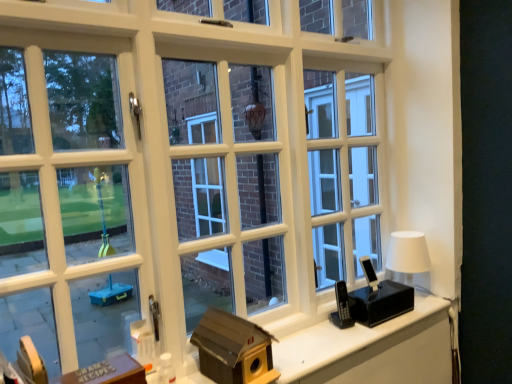
Locate an element on the screen. This screenshot has height=384, width=512. brown cardboard birdhouse at center is located at coordinates (232, 348).

This screenshot has height=384, width=512. In order to click on metallic silver buttons at lower left in this screenshot , I will do `click(108, 372)`.

Is brown cardboard birdhouse at center located within metallic silver buttons at lower left?

No, brown cardboard birdhouse at center is not surrounded by metallic silver buttons at lower left.

From a real-world perspective, is metallic silver buttons at lower left physically located above or below brown cardboard birdhouse at center?

Clearly, from a real-world perspective, metallic silver buttons at lower left is below brown cardboard birdhouse at center.

From the image's perspective, which one is positioned lower, metallic silver buttons at lower left or brown cardboard birdhouse at center?

metallic silver buttons at lower left appears lower in the image.

Who is taller, wooden birdhouse at lower right or metallic silver buttons at lower left?

With more height is metallic silver buttons at lower left.

From the image's perspective, who appears lower, wooden birdhouse at lower right or metallic silver buttons at lower left?

wooden birdhouse at lower right.

I want to click on table that appears on the left of wooden birdhouse at lower right, so 108,372.

Does wooden birdhouse at lower right turn towards metallic silver buttons at lower left?

No, wooden birdhouse at lower right is not facing towards metallic silver buttons at lower left.

Can you tell me how much metallic silver buttons at lower left and wooden birdhouse at lower right differ in facing direction?

0.391 degrees.

This screenshot has height=384, width=512. Find the location of `computer desk behind the metallic silver buttons at lower left`. computer desk behind the metallic silver buttons at lower left is located at coordinates (372, 349).

Is metallic silver buttons at lower left far from wooden birdhouse at lower right?

No, there isn't a large distance between metallic silver buttons at lower left and wooden birdhouse at lower right.

Can you confirm if metallic silver buttons at lower left is positioned to the right of wooden birdhouse at lower right?

No.

Would you say wooden birdhouse at lower right is inside or outside brown cardboard birdhouse at center?

wooden birdhouse at lower right is not inside brown cardboard birdhouse at center, it's outside.

This screenshot has width=512, height=384. In order to click on computer desk in front of the brown cardboard birdhouse at center in this screenshot , I will do `click(372, 349)`.

Can you confirm if wooden birdhouse at lower right is wider than brown cardboard birdhouse at center?

No, wooden birdhouse at lower right is not wider than brown cardboard birdhouse at center.

Who is taller, wooden birdhouse at lower right or brown cardboard birdhouse at center?

With more height is brown cardboard birdhouse at center.

Is the surface of white matte table lamp at right in direct contact with metallic silver buttons at lower left?

white matte table lamp at right and metallic silver buttons at lower left are not in contact.

Is metallic silver buttons at lower left inside white matte table lamp at right?

No, metallic silver buttons at lower left is not a part of white matte table lamp at right.

Is white matte table lamp at right further to the viewer compared to metallic silver buttons at lower left?

Yes, the depth of white matte table lamp at right is greater than that of metallic silver buttons at lower left.

Who is smaller, white matte table lamp at right or metallic silver buttons at lower left?

metallic silver buttons at lower left is smaller.

Considering the relative sizes of metallic silver buttons at lower left and white matte table lamp at right in the image provided, is metallic silver buttons at lower left shorter than white matte table lamp at right?

Indeed, metallic silver buttons at lower left has a lesser height compared to white matte table lamp at right.

Is metallic silver buttons at lower left bigger than white matte table lamp at right?

Actually, metallic silver buttons at lower left might be smaller than white matte table lamp at right.

Between metallic silver buttons at lower left and white matte table lamp at right, which one appears on the left side from the viewer's perspective?

metallic silver buttons at lower left.

Can you confirm if brown cardboard birdhouse at center is shorter than wooden birdhouse at lower right?

No.

Which is behind, point (245, 327) or point (295, 354)?

The point (295, 354) is farther.

Which of these two, brown cardboard birdhouse at center or wooden birdhouse at lower right, is smaller?

brown cardboard birdhouse at center.

Which of these two, brown cardboard birdhouse at center or wooden birdhouse at lower right, is wider?

Wider between the two is brown cardboard birdhouse at center.

Locate an element on the screen. table on the left of brown cardboard birdhouse at center is located at coordinates (108, 372).

Find the location of a particular element. The height and width of the screenshot is (384, 512). table above the wooden birdhouse at lower right (from the image's perspective) is located at coordinates (108, 372).

Considering their positions, is brown cardboard birdhouse at center positioned closer to white matte table lamp at right than metallic silver buttons at lower left?

brown cardboard birdhouse at center is closer to white matte table lamp at right.

Based on their spatial positions, is metallic silver buttons at lower left or brown cardboard birdhouse at center closer to wooden birdhouse at lower right?

brown cardboard birdhouse at center.

From the image, which object appears to be nearer to wooden birdhouse at lower right, white matte table lamp at right or metallic silver buttons at lower left?

white matte table lamp at right is positioned closer to the anchor wooden birdhouse at lower right.

Estimate the real-world distances between objects in this image. Which object is further from metallic silver buttons at lower left, brown cardboard birdhouse at center or wooden birdhouse at lower right?

wooden birdhouse at lower right lies further to metallic silver buttons at lower left than the other object.

Estimate the real-world distances between objects in this image. Which object is further from metallic silver buttons at lower left, white matte table lamp at right or brown cardboard birdhouse at center?

Based on the image, white matte table lamp at right appears to be further to metallic silver buttons at lower left.

Considering their positions, is metallic silver buttons at lower left positioned further to white matte table lamp at right than wooden birdhouse at lower right?

metallic silver buttons at lower left is further to white matte table lamp at right.

Considering their positions, is brown cardboard birdhouse at center positioned closer to white matte table lamp at right than wooden birdhouse at lower right?

wooden birdhouse at lower right lies closer to white matte table lamp at right than the other object.

From the image, which object appears to be farther from brown cardboard birdhouse at center, wooden birdhouse at lower right or white matte table lamp at right?

white matte table lamp at right is further to brown cardboard birdhouse at center.

You are a GUI agent. You are given a task and a screenshot of the screen. Output one action in this format:
    pyautogui.click(x=<x>, y=<y>)
    Task: Click on the computer desk between brown cardboard birdhouse at center and white matte table lamp at right
    The height and width of the screenshot is (384, 512).
    Given the screenshot: What is the action you would take?
    pyautogui.click(x=372, y=349)

You are a GUI agent. You are given a task and a screenshot of the screen. Output one action in this format:
    pyautogui.click(x=<x>, y=<y>)
    Task: Click on the computer desk situated between metallic silver buttons at lower left and white matte table lamp at right from left to right
    This screenshot has height=384, width=512.
    Given the screenshot: What is the action you would take?
    pyautogui.click(x=372, y=349)

At what (x,y) coordinates should I click in order to perform the action: click on box between metallic silver buttons at lower left and wooden birdhouse at lower right. Please return your answer as a coordinate pair (x, y). The width and height of the screenshot is (512, 384). Looking at the image, I should click on coord(232,348).

The height and width of the screenshot is (384, 512). I want to click on box between metallic silver buttons at lower left and white matte table lamp at right, so click(x=232, y=348).